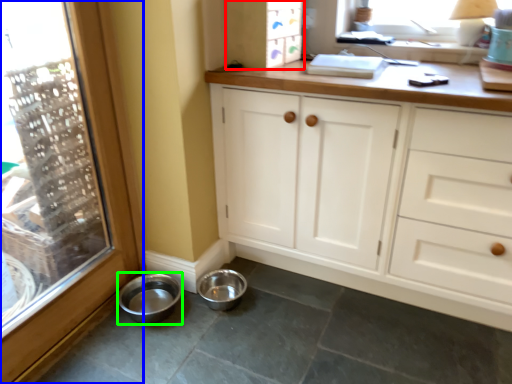
Question: Which is nearer to the cabinetry (highlighted by a red box)? window (highlighted by a blue box) or basin (highlighted by a green box).

Choices:
 (A) window
 (B) basin

Answer: (A)